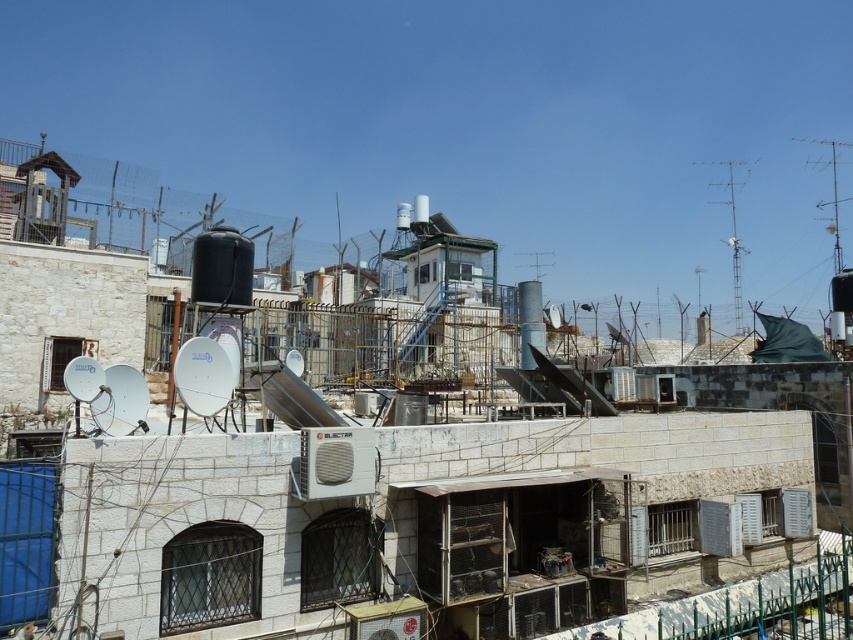
You are a technician assessing rooftop equipment. You need to determine if the metallic gray solar panel at center can be installed lower than the metallic silver dish antenna at upper right without obstructing its signal. Based on their heights, is this possible?

The metallic gray solar panel at center has a lesser height compared to the metallic silver dish antenna at upper right, so it can be installed lower without obstructing the dish antenna at upper right.

You are a technician who needs to install a new device on the rooftop. You have two options for placement locations based on the size of the available space. The metallic gray solar panel at center and the metallic silver dish antenna at upper right. Which object has a larger physical size?

The metallic silver dish antenna at upper right is larger than the metallic gray solar panel at center according to the description.